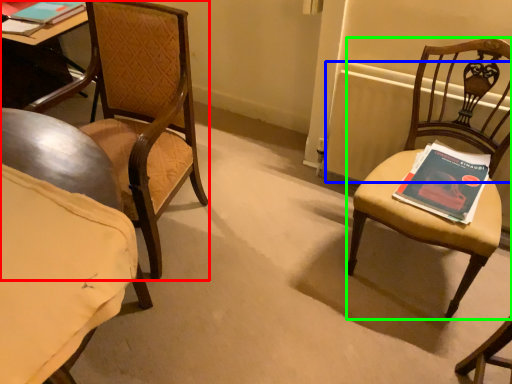
Question: Which is farther away from chair (highlighted by a red box)? radiator (highlighted by a blue box) or chair (highlighted by a green box)?

Choices:
 (A) radiator
 (B) chair

Answer: (B)